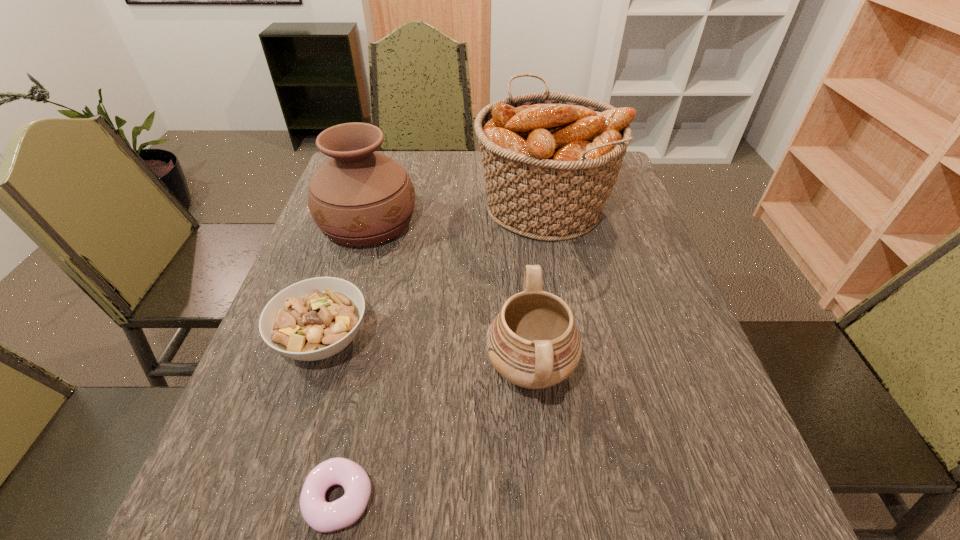
This screenshot has width=960, height=540. What are the coordinates of `the tallest object` in the screenshot? It's located at (550, 160).

Where is `the left urn`? the left urn is located at coordinates (359, 197).

Where is `the taller urn`? The image size is (960, 540). the taller urn is located at coordinates (359, 197).

The width and height of the screenshot is (960, 540). Find the location of `the third shortest object`. the third shortest object is located at coordinates pyautogui.click(x=534, y=343).

In order to click on the shorter urn in this screenshot , I will do `click(534, 343)`.

You are a GUI agent. You are given a task and a screenshot of the screen. Output one action in this format:
    pyautogui.click(x=<x>, y=<y>)
    Task: Click on the fourth tallest object
    This screenshot has height=540, width=960.
    Given the screenshot: What is the action you would take?
    pyautogui.click(x=316, y=318)

I want to click on the shortest object, so click(322, 516).

Where is `the nearest object`? the nearest object is located at coordinates (322, 516).

You are a GUI agent. You are given a task and a screenshot of the screen. Output one action in this format:
    pyautogui.click(x=<x>, y=<y>)
    Task: Click on the free region located on the left of the basket
    This screenshot has height=540, width=960.
    Given the screenshot: What is the action you would take?
    pyautogui.click(x=344, y=205)

Find the location of a particular element. Image resolution: width=960 pixels, height=540 pixels. vacant space located on the front of the second tallest object is located at coordinates (335, 333).